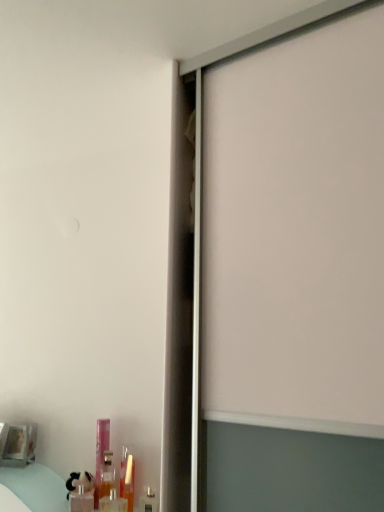
Question: Is translucent plastic bottle at lower left, placed as the third toiletry when sorted from left to right, completely or partially outside of pink plastic bottle at lower left, the 4th toiletry positioned from the right?

Choices:
 (A) no
 (B) yes

Answer: (B)

Question: Is translucent plastic bottle at lower left, placed as the third toiletry when sorted from left to right, facing towards pink plastic bottle at lower left, the second toiletry in the left-to-right sequence?

Choices:
 (A) no
 (B) yes

Answer: (A)

Question: Does translucent plastic bottle at lower left, placed as the 3th toiletry when sorted from right to left, have a greater width compared to pink plastic bottle at lower left, the 4th toiletry positioned from the right?

Choices:
 (A) no
 (B) yes

Answer: (B)

Question: Is translucent plastic bottle at lower left, placed as the 3th toiletry when sorted from right to left, closer to camera compared to pink plastic bottle at lower left, the second toiletry in the left-to-right sequence?

Choices:
 (A) yes
 (B) no

Answer: (A)

Question: Can you confirm if translucent plastic bottle at lower left, placed as the 3th toiletry when sorted from right to left, is taller than pink plastic bottle at lower left, the 4th toiletry positioned from the right?

Choices:
 (A) no
 (B) yes

Answer: (A)

Question: From the image's perspective, is translucent plastic bottle at lower left, placed as the third toiletry when sorted from left to right, positioned above or below translucent plastic bottle at lower left, arranged as the first toiletry when viewed from the left?

Choices:
 (A) below
 (B) above

Answer: (B)

Question: Is translucent plastic bottle at lower left, placed as the third toiletry when sorted from left to right, spatially inside translucent plastic bottle at lower left, arranged as the first toiletry when viewed from the left, or outside of it?

Choices:
 (A) outside
 (B) inside

Answer: (A)

Question: Does point (107, 495) appear closer or farther from the camera than point (71, 500)?

Choices:
 (A) closer
 (B) farther

Answer: (A)

Question: In terms of height, does translucent plastic bottle at lower left, placed as the 3th toiletry when sorted from right to left, look taller or shorter compared to translucent plastic bottle at lower left, arranged as the first toiletry when viewed from the left?

Choices:
 (A) short
 (B) tall

Answer: (B)

Question: From a real-world perspective, relative to translucent plastic bottle at lower left, placed as the 3th toiletry when sorted from right to left, is pink plastic bottle at lower left, the second toiletry in the left-to-right sequence, vertically above or below?

Choices:
 (A) above
 (B) below

Answer: (A)

Question: Does point (94, 492) appear closer or farther from the camera than point (104, 478)?

Choices:
 (A) closer
 (B) farther

Answer: (A)

Question: Is pink plastic bottle at lower left, the 4th toiletry positioned from the right, taller or shorter than translucent plastic bottle at lower left, placed as the 3th toiletry when sorted from right to left?

Choices:
 (A) tall
 (B) short

Answer: (A)

Question: Based on their sizes in the image, would you say pink plastic bottle at lower left, the second toiletry in the left-to-right sequence, is bigger or smaller than translucent plastic bottle at lower left, placed as the third toiletry when sorted from left to right?

Choices:
 (A) small
 (B) big

Answer: (A)

Question: From the image's perspective, is metallic silver toiletry at lower left, which is counted as the fifth toiletry, starting from the left, above or below translucent plastic tube at lower left, marked as the 2th toiletry in a right-to-left arrangement?

Choices:
 (A) below
 (B) above

Answer: (A)

Question: From their relative heights in the image, would you say metallic silver toiletry at lower left, placed as the first toiletry when sorted from right to left, is taller or shorter than translucent plastic tube at lower left, marked as the 2th toiletry in a right-to-left arrangement?

Choices:
 (A) tall
 (B) short

Answer: (B)